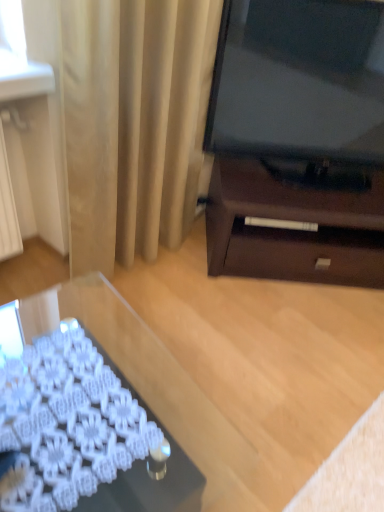
Question: Is transparent glass desk at lower left surrounding beige fabric curtain at upper left?

Choices:
 (A) no
 (B) yes

Answer: (A)

Question: Does transparent glass desk at lower left appear on the right side of beige fabric curtain at upper left?

Choices:
 (A) no
 (B) yes

Answer: (A)

Question: From the image's perspective, is transparent glass desk at lower left on beige fabric curtain at upper left?

Choices:
 (A) yes
 (B) no

Answer: (B)

Question: Is transparent glass desk at lower left next to beige fabric curtain at upper left and touching it?

Choices:
 (A) yes
 (B) no

Answer: (B)

Question: Can you confirm if transparent glass desk at lower left is taller than beige fabric curtain at upper left?

Choices:
 (A) yes
 (B) no

Answer: (B)

Question: Would you consider transparent glass desk at lower left to be distant from beige fabric curtain at upper left?

Choices:
 (A) yes
 (B) no

Answer: (B)

Question: Can you confirm if beige fabric curtain at upper left is thinner than transparent glass desk at lower left?

Choices:
 (A) no
 (B) yes

Answer: (B)

Question: Is transparent glass desk at lower left at the back of beige fabric curtain at upper left?

Choices:
 (A) yes
 (B) no

Answer: (B)

Question: Is beige fabric curtain at upper left to the right of transparent glass desk at lower left from the viewer's perspective?

Choices:
 (A) no
 (B) yes

Answer: (B)

Question: From a real-world perspective, is beige fabric curtain at upper left over transparent glass desk at lower left?

Choices:
 (A) yes
 (B) no

Answer: (A)

Question: Is beige fabric curtain at upper left aimed at transparent glass desk at lower left?

Choices:
 (A) no
 (B) yes

Answer: (A)

Question: Is beige fabric curtain at upper left positioned before transparent glass desk at lower left?

Choices:
 (A) no
 (B) yes

Answer: (A)

Question: Do you think transparent glass desk at lower left is within beige fabric curtain at upper left, or outside of it?

Choices:
 (A) outside
 (B) inside

Answer: (A)